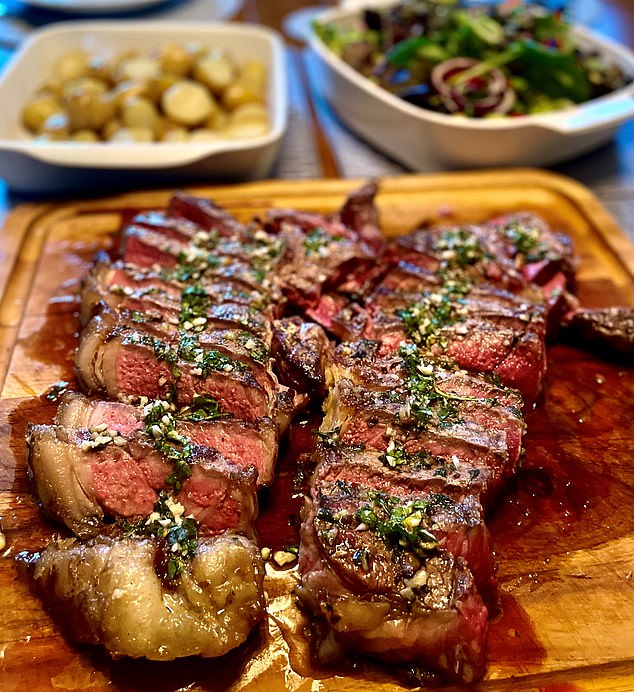
In order to click on dish that would go in oven in this screenshot , I will do pyautogui.click(x=49, y=174), pyautogui.click(x=489, y=153).